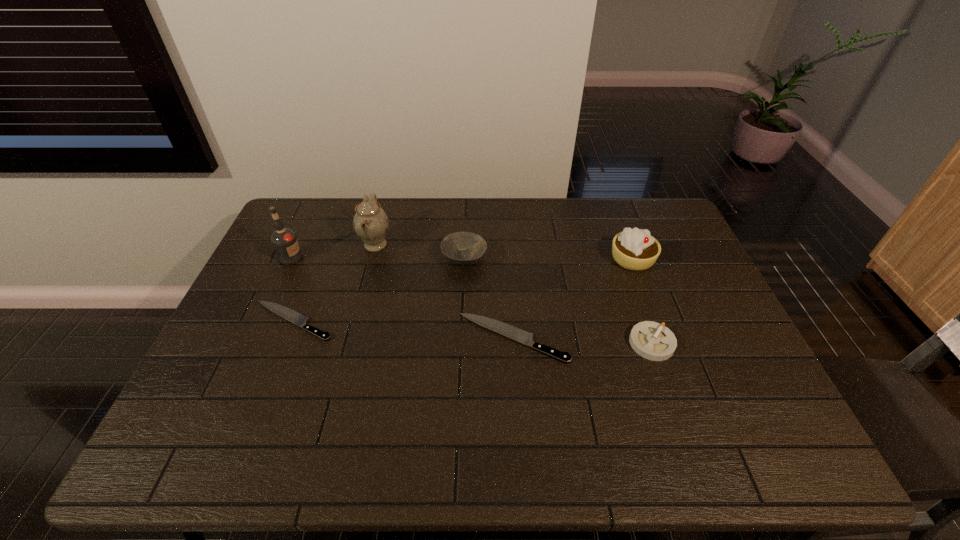
Image resolution: width=960 pixels, height=540 pixels. I want to click on vacant space situated on the back of the second shortest object, so click(x=507, y=245).

The image size is (960, 540). What are the coordinates of `free region located on the left of the fifth shortest object` in the screenshot? It's located at (548, 259).

Where is `vacant point located 0.280m on the front label of the vodka`? This screenshot has width=960, height=540. vacant point located 0.280m on the front label of the vodka is located at coordinates (390, 258).

The height and width of the screenshot is (540, 960). Find the location of `vacant space located 0.390m on the back of the fifth tallest object`. vacant space located 0.390m on the back of the fifth tallest object is located at coordinates (615, 238).

Image resolution: width=960 pixels, height=540 pixels. Find the location of `vacant region located 0.060m on the spout of the chinaware`. vacant region located 0.060m on the spout of the chinaware is located at coordinates (410, 245).

Where is `vacant space located 0.250m on the front of the fourth tallest object`? vacant space located 0.250m on the front of the fourth tallest object is located at coordinates (461, 336).

What are the coordinates of `object present at the far edge` in the screenshot? It's located at (370, 222).

The image size is (960, 540). I want to click on steak knife situated at the left edge, so click(x=285, y=312).

At what (x,y) coordinates should I click in order to perform the action: click on vodka at the left edge. Please return your answer as a coordinate pair (x, y). Looking at the image, I should click on (284, 240).

This screenshot has width=960, height=540. I want to click on object located at the right edge, so click(635, 249).